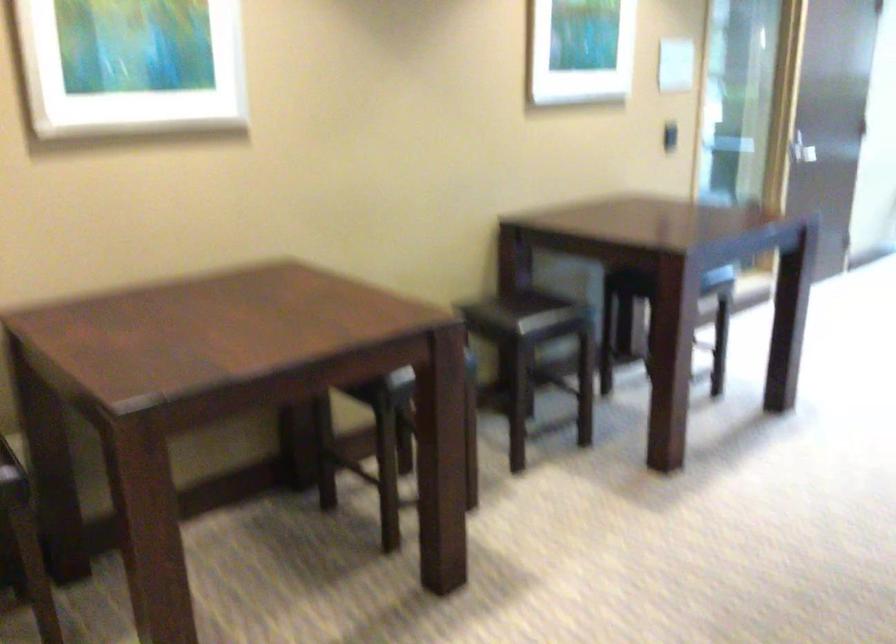
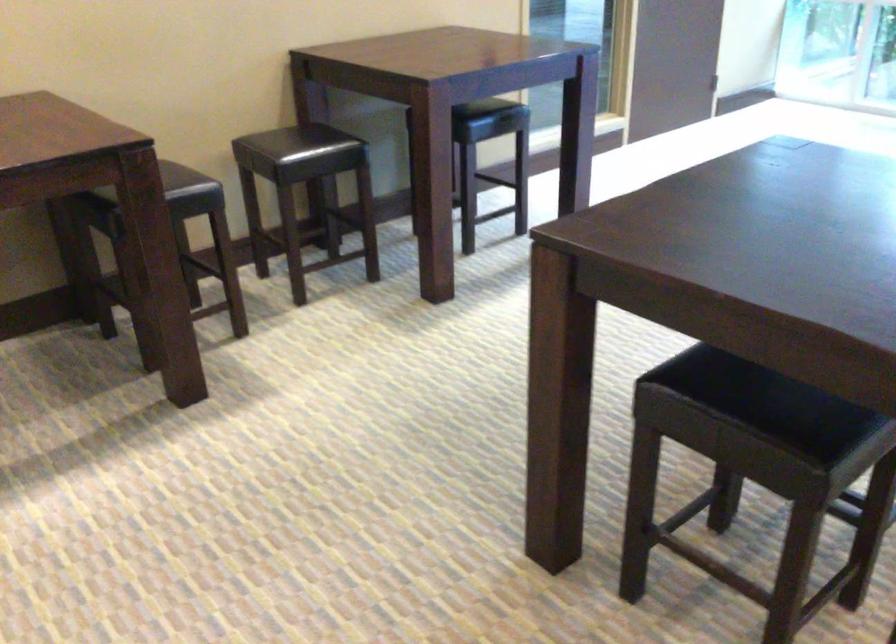
In the second image, find the point that corresponds to [450,359] in the first image.

(168, 182)